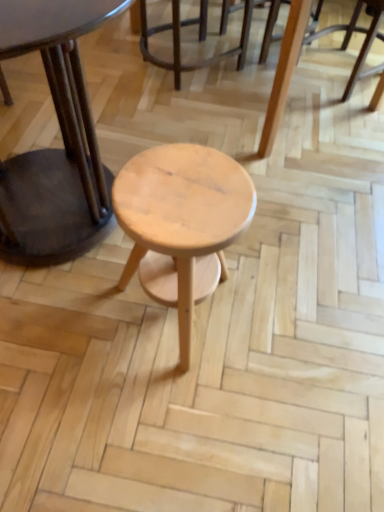
This screenshot has width=384, height=512. In order to click on matte black table at center in this screenshot , I will do `click(62, 136)`.

Is point (150, 242) positioned in front of point (353, 74)?

Yes, it is in front of point (353, 74).

Is natural wood stool at center beside light brown wood chair at center?

No.

In the image, there is a natural wood stool at center. Where is `chair below it (from a real-world perspective)`? The height and width of the screenshot is (512, 384). chair below it (from a real-world perspective) is located at coordinates (363, 42).

From a real-world perspective, who is located higher, natural wood stool at center or light brown wood chair at center?

natural wood stool at center.

Which is in front, point (354, 15) or point (151, 189)?

Point (151, 189)

From the picture: Considering the relative sizes of light brown wood chair at center and natural wood stool at center in the image provided, is light brown wood chair at center taller than natural wood stool at center?

No.

Which object is positioned more to the left, light brown wood chair at center or natural wood stool at center?

From the viewer's perspective, natural wood stool at center appears more on the left side.

From the image's perspective, who appears lower, light brown wood chair at center or natural wood stool at center?

natural wood stool at center is shown below in the image.

Could light brown wood chair at center be considered to be inside matte black table at center?

Actually, light brown wood chair at center is outside matte black table at center.

Is matte black table at center taller or shorter than light brown wood chair at center?

Clearly, matte black table at center is taller compared to light brown wood chair at center.

Which point is more distant from viewer, (48, 244) or (356, 68)?

Positioned behind is point (356, 68).

Can you confirm if matte black table at center is taller than natural wood stool at center?

Yes, matte black table at center is taller than natural wood stool at center.

From a real-world perspective, is matte black table at center on natural wood stool at center?

Correct, in the physical world, matte black table at center is higher than natural wood stool at center.

Is the surface of matte black table at center in direct contact with natural wood stool at center?

No, matte black table at center is not making contact with natural wood stool at center.

Who is smaller, matte black table at center or natural wood stool at center?

Smaller between the two is natural wood stool at center.

In the scene shown: Is natural wood stool at center positioned with its back to matte black table at center?

No, matte black table at center is not at the back of natural wood stool at center.

Does natural wood stool at center come behind matte black table at center?

Yes, it is behind matte black table at center.

Is point (247, 216) more distant than point (99, 234)?

No.

From a real-world perspective, relative to matte black table at center, is light brown wood chair at center vertically above or below?

From a real-world perspective, light brown wood chair at center is physically below matte black table at center.

There is a light brown wood chair at center. Where is `table above it (from a real-world perspective)`? Image resolution: width=384 pixels, height=512 pixels. table above it (from a real-world perspective) is located at coordinates (62, 136).

Is matte black table at center located within light brown wood chair at center?

Actually, matte black table at center is outside light brown wood chair at center.

Does light brown wood chair at center have a greater height compared to matte black table at center?

In fact, light brown wood chair at center may be shorter than matte black table at center.

At what (x,y) coordinates should I click in order to perform the action: click on chair that appears on the right of natural wood stool at center. Please return your answer as a coordinate pair (x, y). The height and width of the screenshot is (512, 384). Looking at the image, I should click on (363, 42).

At what (x,y) coordinates should I click in order to perform the action: click on chair above the natural wood stool at center (from the image's perspective). Please return your answer as a coordinate pair (x, y). This screenshot has height=512, width=384. Looking at the image, I should click on (363, 42).

When comparing their distances from light brown wood chair at center, does matte black table at center or natural wood stool at center seem further?

Among the two, natural wood stool at center is located further to light brown wood chair at center.

Based on their spatial positions, is light brown wood chair at center or matte black table at center closer to natural wood stool at center?

matte black table at center is positioned closer to the anchor natural wood stool at center.

Based on their spatial positions, is natural wood stool at center or matte black table at center closer to light brown wood chair at center?

Among the two, matte black table at center is located nearer to light brown wood chair at center.

When comparing their distances from matte black table at center, does natural wood stool at center or light brown wood chair at center seem closer?

natural wood stool at center.

Based on their spatial positions, is matte black table at center or light brown wood chair at center further from natural wood stool at center?

light brown wood chair at center lies further to natural wood stool at center than the other object.

Based on their spatial positions, is light brown wood chair at center or natural wood stool at center further from matte black table at center?

Based on the image, light brown wood chair at center appears to be further to matte black table at center.

This screenshot has width=384, height=512. I want to click on stool situated between matte black table at center and light brown wood chair at center from left to right, so click(x=183, y=219).